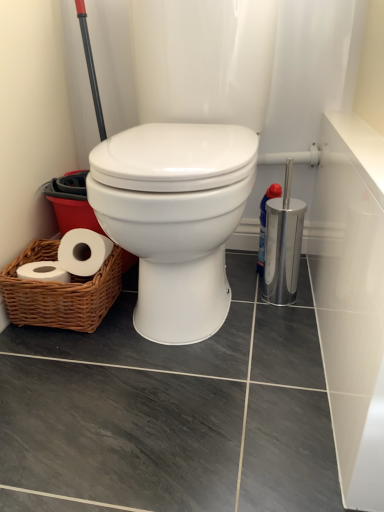
Question: Based on their positions, is white glossy toilet at center located to the left or right of woven brown basket at lower left?

Choices:
 (A) right
 (B) left

Answer: (A)

Question: From a real-world perspective, is white glossy toilet at center positioned above or below woven brown basket at lower left?

Choices:
 (A) above
 (B) below

Answer: (A)

Question: Is white glossy toilet at center in front of or behind woven brown basket at lower left in the image?

Choices:
 (A) front
 (B) behind

Answer: (A)

Question: From their relative heights in the image, would you say woven brown basket at lower left is taller or shorter than white glossy toilet at center?

Choices:
 (A) tall
 (B) short

Answer: (B)

Question: From the image's perspective, relative to white glossy toilet at center, is woven brown basket at lower left above or below?

Choices:
 (A) below
 (B) above

Answer: (A)

Question: Is woven brown basket at lower left spatially inside white glossy toilet at center, or outside of it?

Choices:
 (A) inside
 (B) outside

Answer: (B)

Question: From a real-world perspective, relative to white glossy toilet at center, is woven brown basket at lower left vertically above or below?

Choices:
 (A) below
 (B) above

Answer: (A)